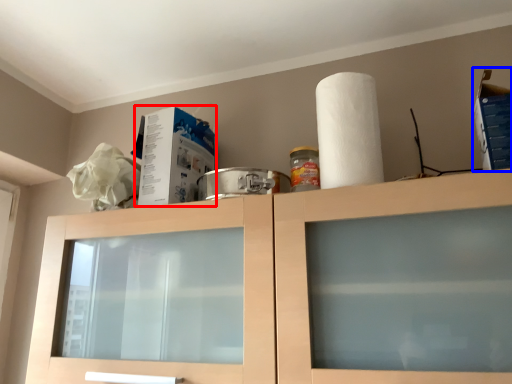
Question: Which object is further to the camera taking this photo, box (highlighted by a red box) or box (highlighted by a blue box)?

Choices:
 (A) box
 (B) box

Answer: (A)